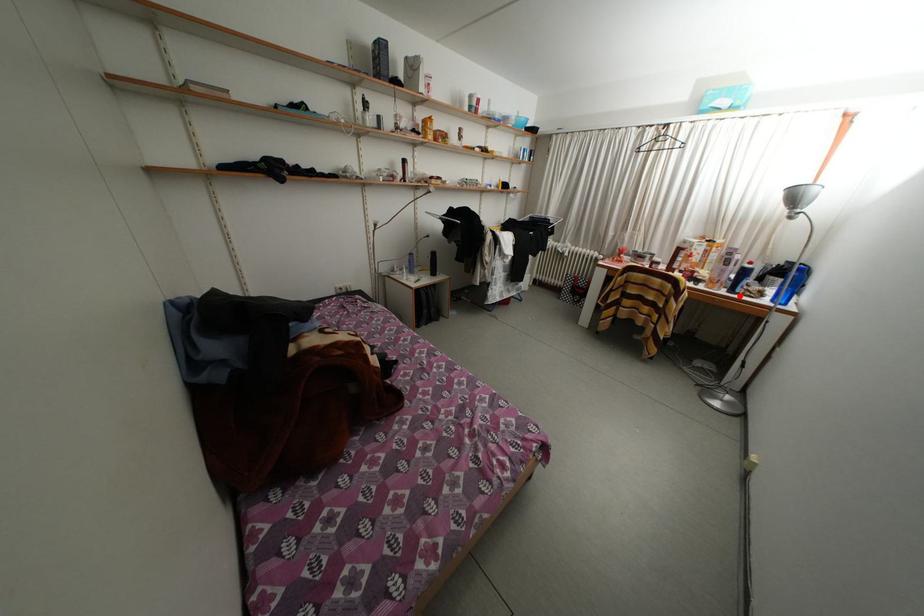
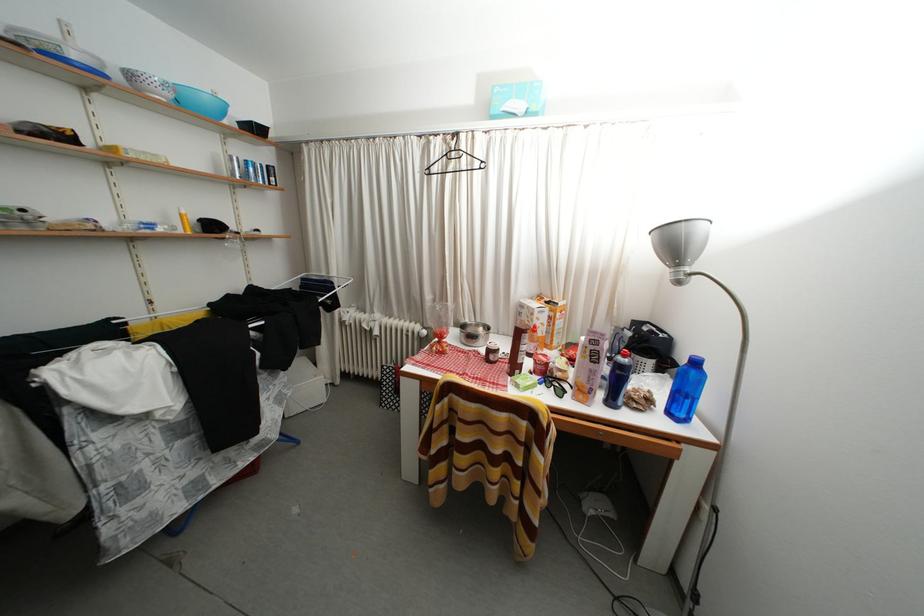
Question: I am providing you with two images of the same scene from different viewpoints. In image1, a red point is highlighted. Considering the same 3D point in image2, which of the following is correct?

Choices:
 (A) It is closer
 (B) It is farther

Answer: (B)